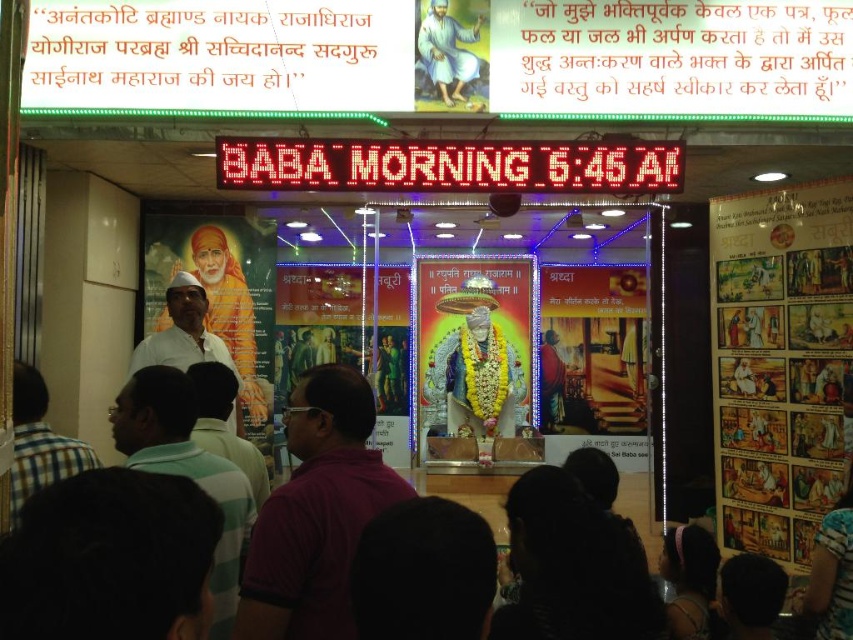
Can you confirm if purple cotton shirt at center is positioned to the right of white cloth at upper center?

Incorrect, purple cotton shirt at center is not on the right side of white cloth at upper center.

Which of these two, purple cotton shirt at center or white cloth at upper center, stands shorter?

white cloth at upper center

Is point (383, 502) more distant than point (439, 20)?

No, it is not.

You are a GUI agent. You are given a task and a screenshot of the screen. Output one action in this format:
    pyautogui.click(x=<x>, y=<y>)
    Task: Click on the purple cotton shirt at center
    The height and width of the screenshot is (640, 853).
    Given the screenshot: What is the action you would take?
    tap(316, 513)

Between matte paper poster at right and purple cotton shirt at center, which one has less height?

Standing shorter between the two is purple cotton shirt at center.

Which is more to the right, matte paper poster at right or purple cotton shirt at center?

Positioned to the right is matte paper poster at right.

Between point (727, 262) and point (258, 573), which one is positioned behind?

The point (727, 262) is behind.

Image resolution: width=853 pixels, height=640 pixels. In order to click on matte paper poster at right in this screenshot , I will do `click(779, 362)`.

Which is behind, point (364, 508) or point (15, 380)?

Point (15, 380)

Is purple cotton shirt at center above plaid shirt at lower left?

No, purple cotton shirt at center is not above plaid shirt at lower left.

Is point (297, 554) more distant than point (27, 465)?

No, it is in front of (27, 465).

You are a GUI agent. You are given a task and a screenshot of the screen. Output one action in this format:
    pyautogui.click(x=<x>, y=<y>)
    Task: Click on the purple cotton shirt at center
    
    Given the screenshot: What is the action you would take?
    pyautogui.click(x=316, y=513)